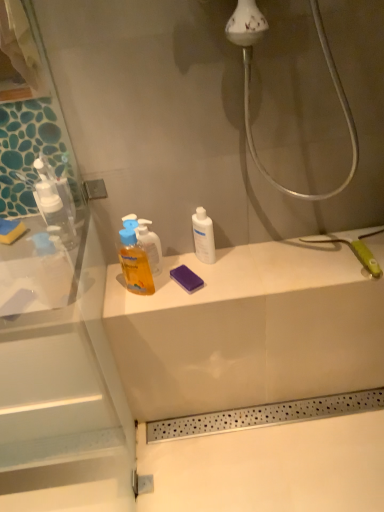
Question: From a real-world perspective, is translucent plastic bottle at center physically located above or below white matte bottle at center?

Choices:
 (A) above
 (B) below

Answer: (A)

Question: Is point (119, 259) closer or farther from the camera than point (203, 240)?

Choices:
 (A) farther
 (B) closer

Answer: (A)

Question: Looking at the image, does translucent plastic bottle at center seem bigger or smaller compared to white matte bottle at center?

Choices:
 (A) small
 (B) big

Answer: (B)

Question: Is white matte bottle at center bigger or smaller than translucent plastic bottle at center?

Choices:
 (A) big
 (B) small

Answer: (B)

Question: Is point (198, 250) positioned closer to the camera than point (147, 282)?

Choices:
 (A) closer
 (B) farther

Answer: (B)

Question: From a real-world perspective, is white matte bottle at center physically located above or below translucent plastic bottle at center?

Choices:
 (A) below
 (B) above

Answer: (A)

Question: Is white matte bottle at center to the left or to the right of translucent plastic bottle at center in the image?

Choices:
 (A) right
 (B) left

Answer: (A)